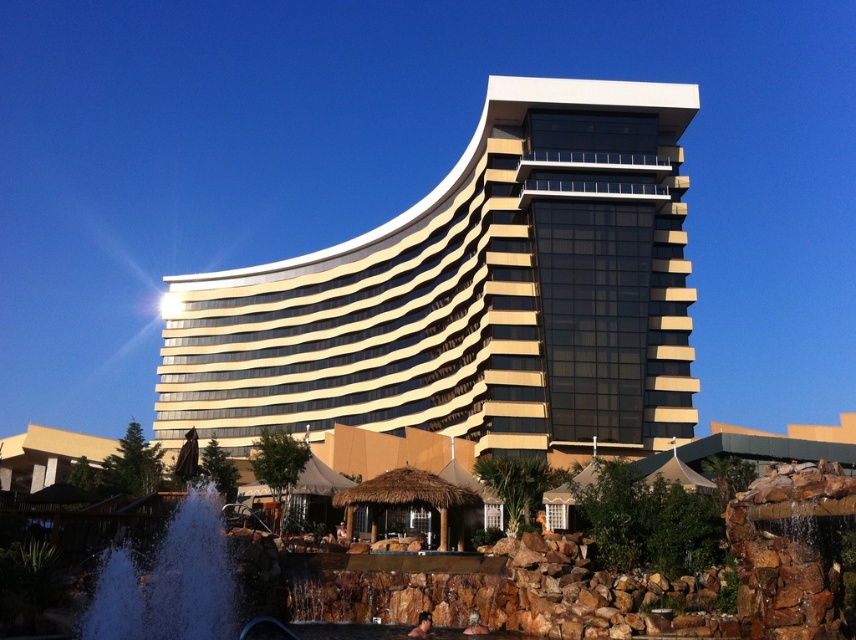
Question: Where is gold glass building at center located in relation to white frothy water at lower left in the image?

Choices:
 (A) left
 (B) right

Answer: (A)

Question: Among these objects, which one is nearest to the camera?

Choices:
 (A) gold glass building at center
 (B) white frothy water at lower left

Answer: (B)

Question: Can you confirm if gold glass building at center is smaller than white frothy water at lower left?

Choices:
 (A) no
 (B) yes

Answer: (A)

Question: Does gold glass building at center have a lesser width compared to white frothy water at lower left?

Choices:
 (A) no
 (B) yes

Answer: (A)